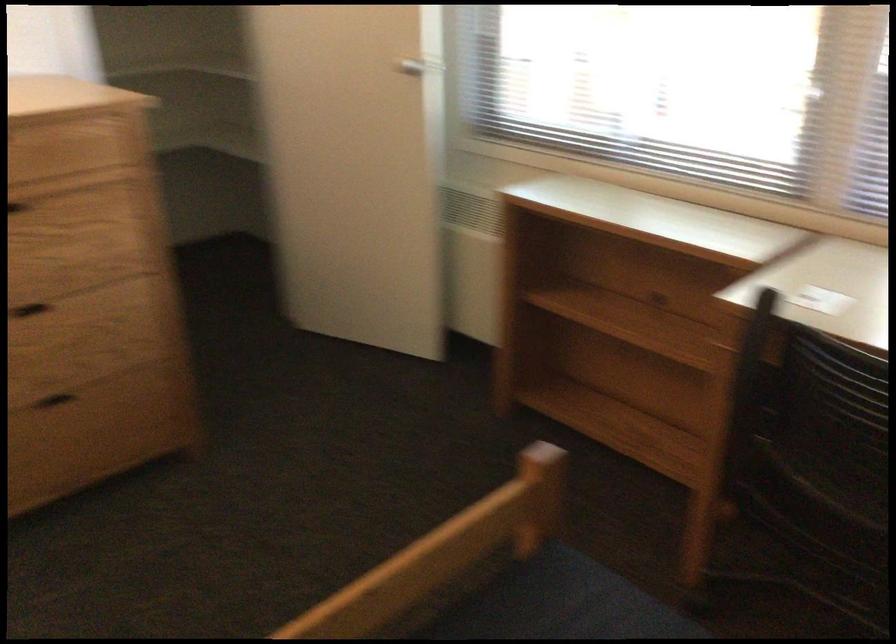
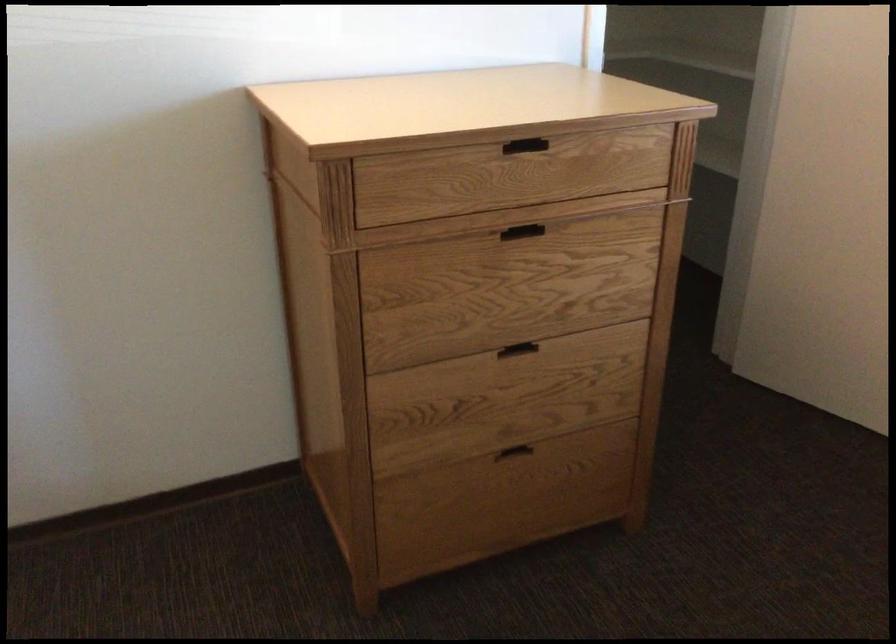
Which direction would the cameraman need to move to produce the second image?

The cameraman moved toward left, forward.